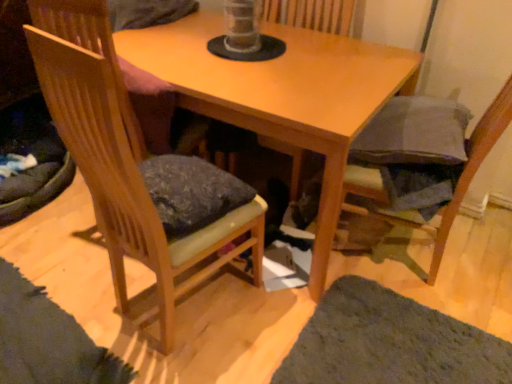
Where is `free space to the left of green shaggy rug at lower right`? This screenshot has width=512, height=384. free space to the left of green shaggy rug at lower right is located at coordinates pyautogui.click(x=233, y=329).